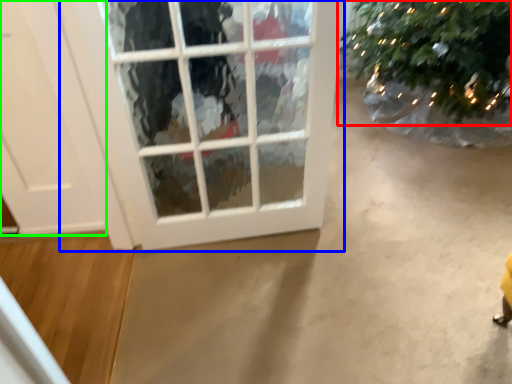
Question: Estimate the real-world distances between objects in this image. Which object is closer to christmas tree (highlighted by a red box), window (highlighted by a blue box) or door (highlighted by a green box)?

Choices:
 (A) window
 (B) door

Answer: (A)